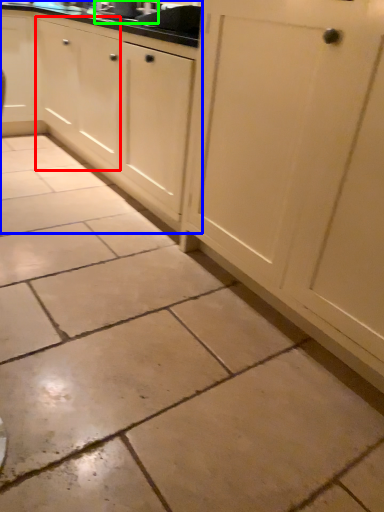
Question: Which object is the closest to the cabinetry (highlighted by a red box)? Choose among these: cabinetry (highlighted by a blue box) or sink (highlighted by a green box).

Choices:
 (A) cabinetry
 (B) sink

Answer: (A)